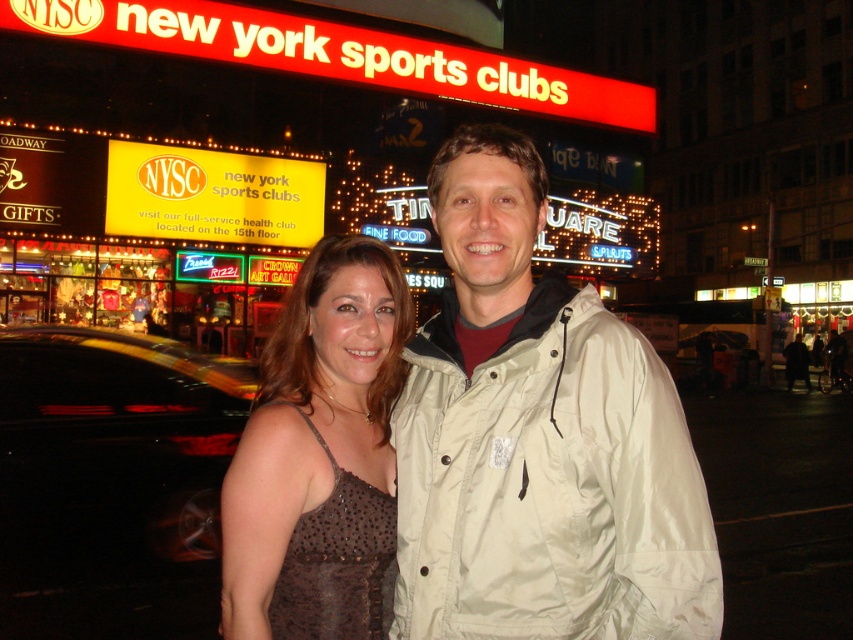
Question: Which object is farther from the camera taking this photo?

Choices:
 (A) brown satin dress at center
 (B) light beige jacket at center

Answer: (A)

Question: From the image, what is the correct spatial relationship of light beige jacket at center in relation to brown satin dress at center?

Choices:
 (A) above
 (B) below

Answer: (A)

Question: Where is light beige jacket at center located in relation to brown satin dress at center in the image?

Choices:
 (A) right
 (B) left

Answer: (A)

Question: Which point is farther to the camera?

Choices:
 (A) light beige jacket at center
 (B) brown satin dress at center

Answer: (B)

Question: Can you confirm if light beige jacket at center is positioned to the left of brown satin dress at center?

Choices:
 (A) yes
 (B) no

Answer: (B)

Question: Which of the following is the closest to the observer?

Choices:
 (A) light beige jacket at center
 (B) brown satin dress at center

Answer: (A)